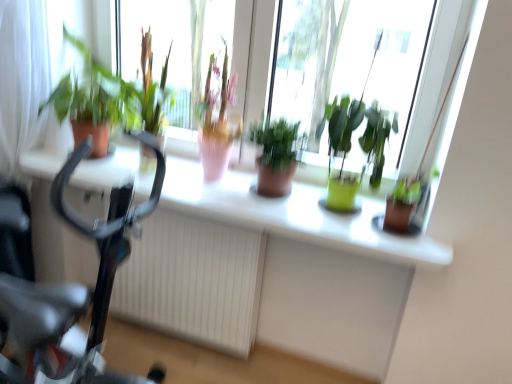
You are a GUI agent. You are given a task and a screenshot of the screen. Output one action in this format:
    pyautogui.click(x=<x>, y=<y>)
    Task: Click on the free spot in front of white textured radiator at center
    The image size is (512, 384).
    Given the screenshot: What is the action you would take?
    pyautogui.click(x=170, y=360)